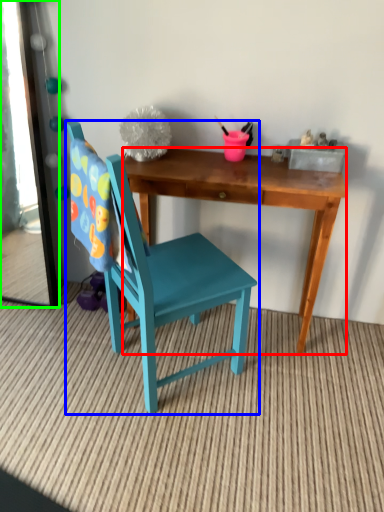
Question: Considering the real-world distances, which object is closest to desk (highlighted by a red box)? chair (highlighted by a blue box) or mirror (highlighted by a green box).

Choices:
 (A) chair
 (B) mirror

Answer: (A)